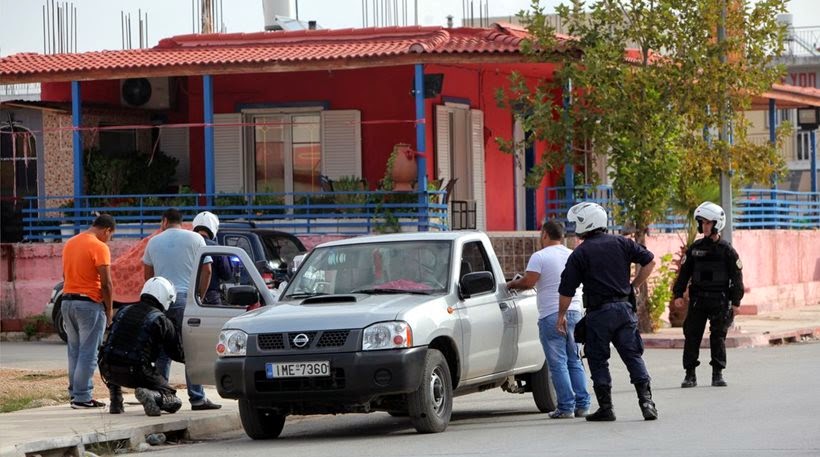
At what (x,y) coordinates should I click in order to perform the action: click on windows. Please return your answer as a coordinate pair (x, y). Image resolution: width=820 pixels, height=457 pixels. Looking at the image, I should click on [x=298, y=134], [x=467, y=140].